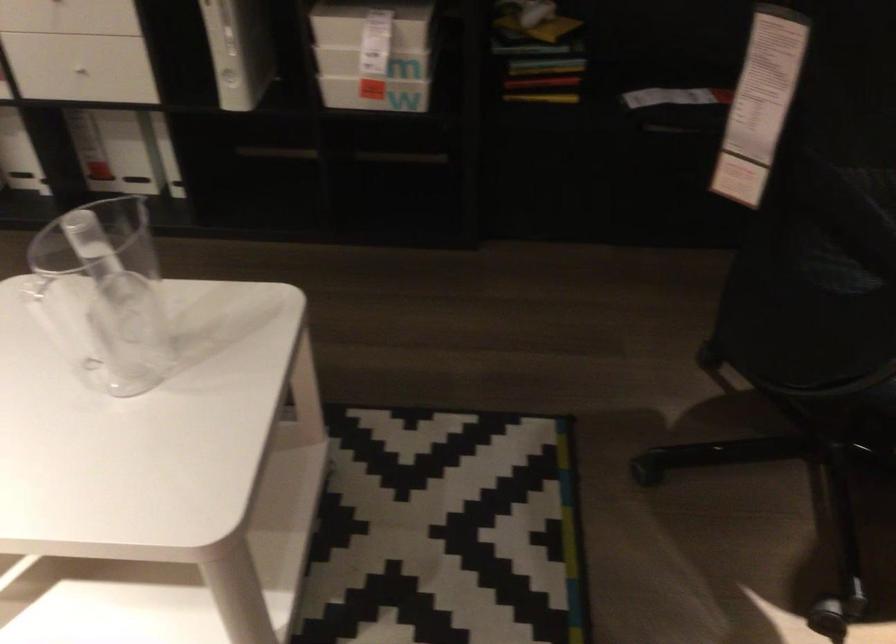
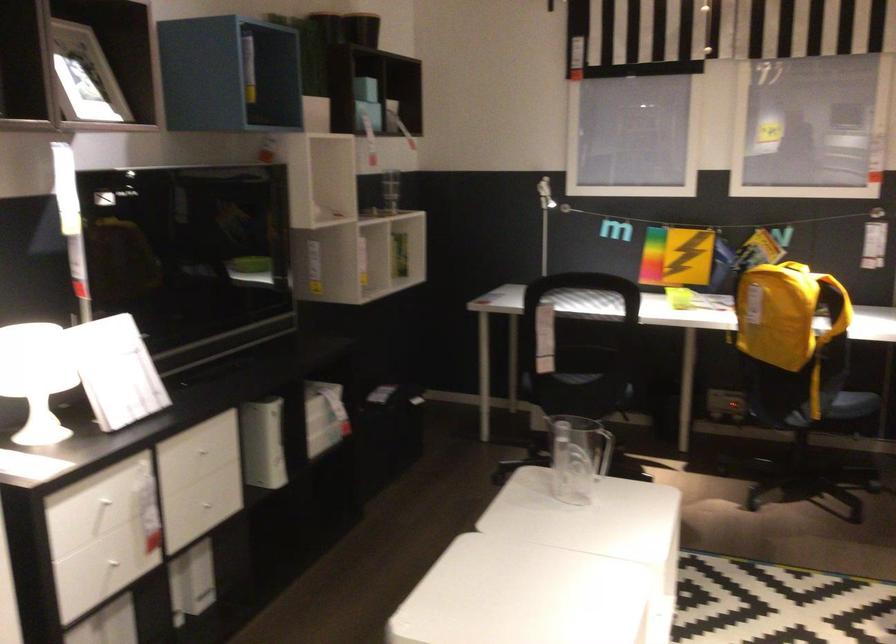
Find the pixel in the second image that matches (x=779, y=292) in the first image.

(571, 393)